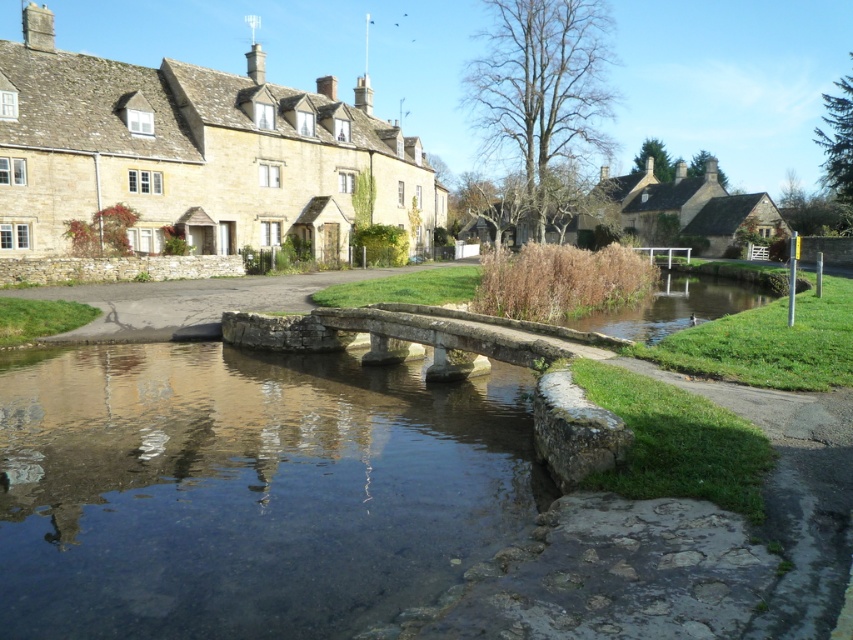
You are standing at point (320, 92) and want to walk to the stone bridge in the scene. Which direction should you move to reach the bridge first, towards point (334, 528) or away from it?

You should move towards point (334, 528) because it is in front of point (320, 92), meaning the bridge is closer in that direction.

You are a tourist standing on the stone bridge and looking towards the stone village at upper left and the matte stone house at center. Which structure appears taller from your vantage point?

The matte stone house at center appears taller because it is taller than the stone village at upper left.

You are standing at the point marked as point (247, 490) in the image. What do you see directly beneath your feet?

You see clear stone water at center directly beneath your feet.